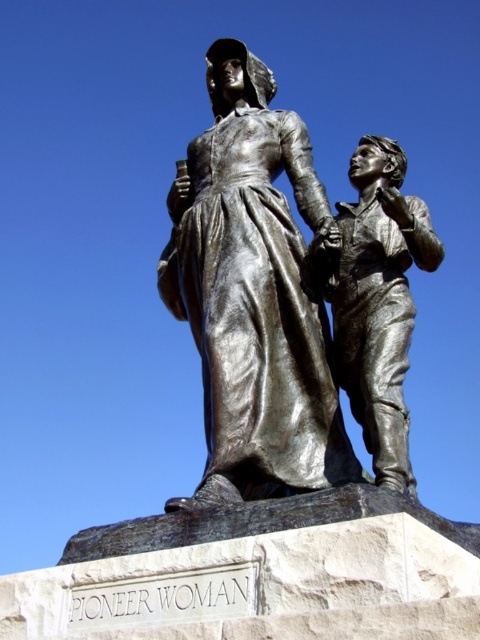
Question: Can you confirm if shiny bronze statue at center is positioned to the right of polished bronze statue at center?

Choices:
 (A) no
 (B) yes

Answer: (A)

Question: Can you confirm if shiny bronze statue at center is positioned below polished bronze statue at center?

Choices:
 (A) no
 (B) yes

Answer: (B)

Question: Which of the following is the farthest from the observer?

Choices:
 (A) (383, 433)
 (B) (201, 163)

Answer: (B)

Question: Is shiny bronze statue at center bigger than polished bronze statue at center?

Choices:
 (A) yes
 (B) no

Answer: (A)

Question: Which point appears closest to the camera in this image?

Choices:
 (A) (419, 227)
 (B) (230, 240)

Answer: (A)

Question: Among these points, which one is nearest to the camera?

Choices:
 (A) (288, 266)
 (B) (411, 240)

Answer: (B)